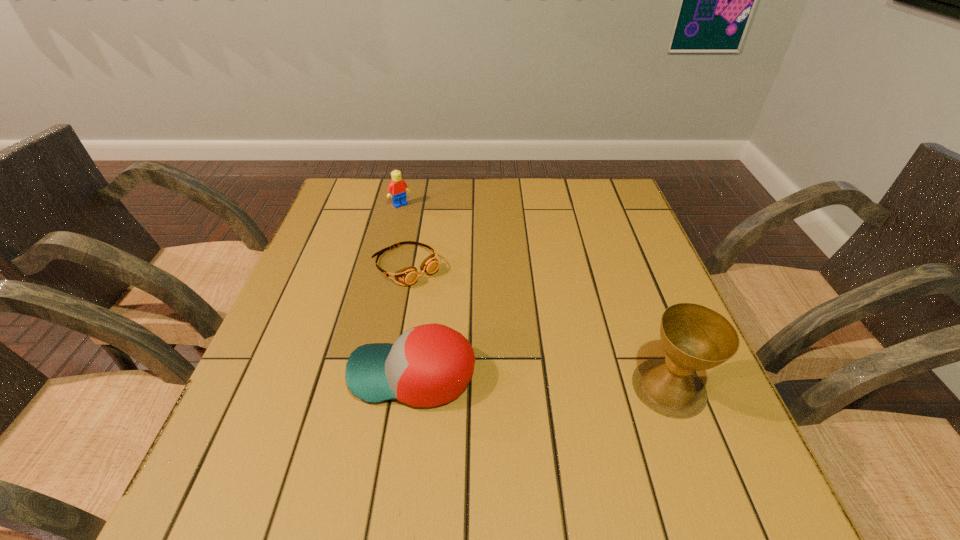
Find the location of a particular element. This screenshot has width=960, height=540. free point between the baseball cap and the goggles is located at coordinates (409, 320).

You are a GUI agent. You are given a task and a screenshot of the screen. Output one action in this format:
    pyautogui.click(x=<x>, y=<y>)
    Task: Click on the free space between the tallest object and the farthest object
    
    Given the screenshot: What is the action you would take?
    pyautogui.click(x=535, y=296)

Where is `vacant area that lies between the chalice and the baseball cap`? The image size is (960, 540). vacant area that lies between the chalice and the baseball cap is located at coordinates (540, 381).

Locate an element on the screen. This screenshot has width=960, height=540. vacant space in between the rightmost object and the shortest object is located at coordinates (538, 327).

At what (x,y) coordinates should I click in order to perform the action: click on unoccupied area between the second farthest object and the Lego. Please return your answer as a coordinate pair (x, y). This screenshot has height=540, width=960. Looking at the image, I should click on (402, 235).

The width and height of the screenshot is (960, 540). Find the location of `free space between the goggles and the Lego`. free space between the goggles and the Lego is located at coordinates (402, 235).

The height and width of the screenshot is (540, 960). In order to click on free space that is in between the farthest object and the tallest object in this screenshot , I will do `click(535, 296)`.

I want to click on object that is the second closest to the second farthest object, so click(x=397, y=189).

Locate an element on the screen. This screenshot has height=540, width=960. the third closest object to the Lego is located at coordinates (694, 337).

Locate an element on the screen. The image size is (960, 540). vacant region that satisfies the following two spatial constraints: 1. on the front side of the rightmost object; 2. on the right side of the second farthest object is located at coordinates (382, 387).